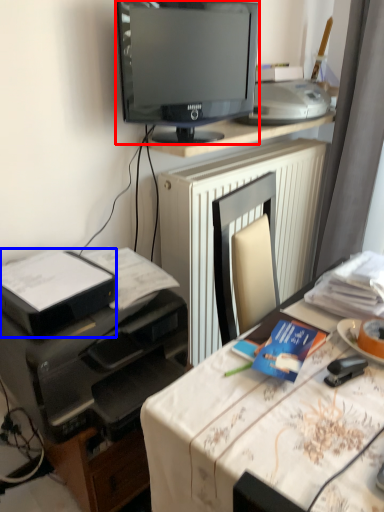
Question: Which object appears closest to the camera in this image, television (highlighted by a red box) or printer (highlighted by a blue box)?

Choices:
 (A) television
 (B) printer

Answer: (B)